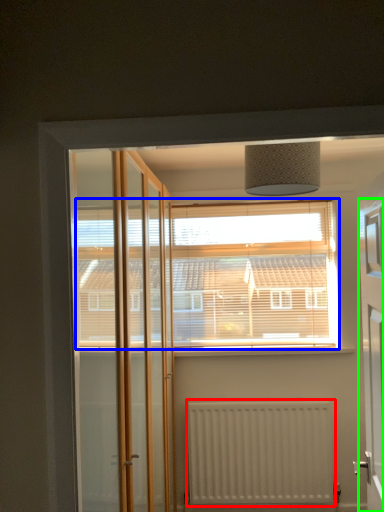
Question: Which object is the closest to the radiator (highlighted by a red box)? Choose among these: window (highlighted by a blue box) or elevator (highlighted by a green box).

Choices:
 (A) window
 (B) elevator

Answer: (A)